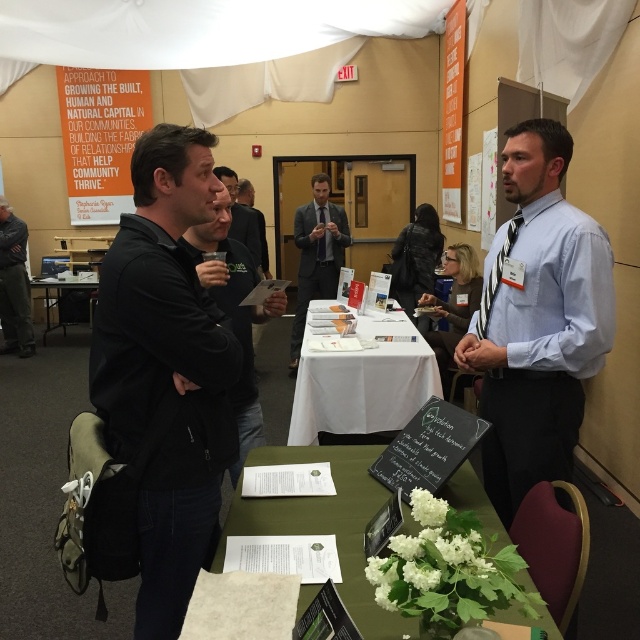
Can you confirm if matte gray suit at center is smaller than black leather jacket at left?

No, matte gray suit at center is not smaller than black leather jacket at left.

Between matte gray suit at center and black leather jacket at left, which one is positioned lower?

black leather jacket at left

At what (x,y) coordinates should I click in order to perform the action: click on matte gray suit at center. Please return your answer as a coordinate pair (x, y). This screenshot has height=640, width=640. Looking at the image, I should click on (316, 256).

The image size is (640, 640). In order to click on matte gray suit at center in this screenshot , I will do `click(316, 256)`.

Find the location of a particular element. This screenshot has height=640, width=640. black matte jacket at left is located at coordinates (164, 371).

Can you confirm if black matte jacket at left is wider than light blue shirt at center?

No, black matte jacket at left is not wider than light blue shirt at center.

The image size is (640, 640). In order to click on black matte jacket at left in this screenshot , I will do `click(164, 371)`.

Can you confirm if light blue shirt at center is positioned to the right of black shirt at center?

Indeed, light blue shirt at center is positioned on the right side of black shirt at center.

Does point (532, 131) lie behind point (248, 244)?

No.

Locate an element on the screen. The width and height of the screenshot is (640, 640). light blue shirt at center is located at coordinates (538, 320).